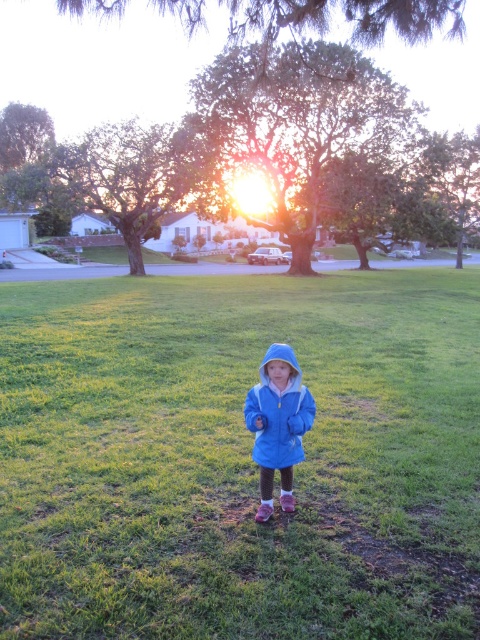
Question: Does blue fleece jacket at center appear on the right side of matte blue jacket at center?

Choices:
 (A) no
 (B) yes

Answer: (B)

Question: Which object is farther from the camera taking this photo?

Choices:
 (A) blue fleece jacket at center
 (B) matte blue jacket at center

Answer: (B)

Question: Among these points, which one is nearest to the camera?

Choices:
 (A) (310, 401)
 (B) (444, 627)

Answer: (B)

Question: Is blue fleece jacket at center to the left of matte blue jacket at center from the viewer's perspective?

Choices:
 (A) no
 (B) yes

Answer: (A)

Question: Which point is farther from the camera taking this photo?

Choices:
 (A) (48, 406)
 (B) (276, 426)

Answer: (A)

Question: Does blue fleece jacket at center lie in front of matte blue jacket at center?

Choices:
 (A) yes
 (B) no

Answer: (A)